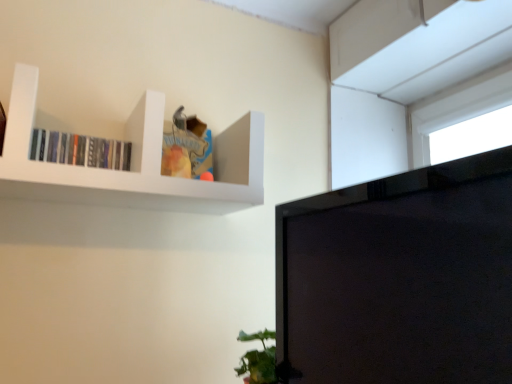
The image size is (512, 384). Describe the element at coordinates (80, 150) in the screenshot. I see `matte black books at upper left` at that location.

Identify the location of white matte shelf at upper left. (132, 163).

The image size is (512, 384). In order to click on matte black books at upper left in this screenshot , I will do `click(80, 150)`.

Does black glossy monitor at upper right have a lesser height compared to white matte shelf at upper left?

Incorrect, the height of black glossy monitor at upper right does not fall short of that of white matte shelf at upper left.

Which is correct: black glossy monitor at upper right is inside white matte shelf at upper left, or outside of it?

black glossy monitor at upper right cannot be found inside white matte shelf at upper left.

Locate an element on the screen. shelf located above the black glossy monitor at upper right (from the image's perspective) is located at coordinates (132, 163).

Where is `shelf that is above the black glossy monitor at upper right (from the image's perspective)`? The image size is (512, 384). shelf that is above the black glossy monitor at upper right (from the image's perspective) is located at coordinates (132, 163).

Between white matte shelf at upper left and black glossy monitor at upper right, which one has smaller width?

black glossy monitor at upper right.

Is white matte shelf at upper left placed right next to black glossy monitor at upper right?

white matte shelf at upper left and black glossy monitor at upper right are not in contact.

From a real-world perspective, is white matte shelf at upper left physically located above or below black glossy monitor at upper right?

white matte shelf at upper left is situated higher than black glossy monitor at upper right in the real world.

Is black glossy monitor at upper right completely or partially outside of matte black books at upper left?

Yes.

Could you tell me if black glossy monitor at upper right is turned towards matte black books at upper left?

No, black glossy monitor at upper right is not oriented towards matte black books at upper left.

Can you confirm if black glossy monitor at upper right is positioned to the left of matte black books at upper left?

No.

Who is more distant, black glossy monitor at upper right or matte black books at upper left?

matte black books at upper left is further away from the camera.

Based on the photo, considering the positions of objects matte black books at upper left and white matte shelf at upper left in the image provided, who is behind, matte black books at upper left or white matte shelf at upper left?

matte black books at upper left is further away from the camera.

Which of these two, matte black books at upper left or white matte shelf at upper left, is smaller?

Smaller between the two is matte black books at upper left.

Is matte black books at upper left situated inside white matte shelf at upper left or outside?

matte black books at upper left is inside white matte shelf at upper left.

Is matte black books at upper left oriented towards black glossy monitor at upper right?

No, matte black books at upper left is not aimed at black glossy monitor at upper right.

Is point (41, 132) closer or farther from the camera than point (311, 323)?

Point (41, 132) is farther from the camera than point (311, 323).

Considering the positions of objects matte black books at upper left and black glossy monitor at upper right in the image provided, who is more to the left, matte black books at upper left or black glossy monitor at upper right?

From the viewer's perspective, matte black books at upper left appears more on the left side.

From a real-world perspective, is white matte shelf at upper left physically below matte black books at upper left?

Yes.

From the image's perspective, which is below, white matte shelf at upper left or matte black books at upper left?

white matte shelf at upper left is shown below in the image.

Find the location of `shelf below the matte black books at upper left (from the image's perspective)`. shelf below the matte black books at upper left (from the image's perspective) is located at coordinates (132, 163).

In the image, there is a black glossy monitor at upper right. Where is `shelf above it (from the image's perspective)`? shelf above it (from the image's perspective) is located at coordinates (132, 163).

Identify the location of computer monitor below the white matte shelf at upper left (from the image's perspective). The image size is (512, 384). (399, 278).

Estimate the real-world distances between objects in this image. Which object is further from black glossy monitor at upper right, matte black books at upper left or white matte shelf at upper left?

Among the two, matte black books at upper left is located further to black glossy monitor at upper right.

Based on their spatial positions, is white matte shelf at upper left or matte black books at upper left further from black glossy monitor at upper right?

matte black books at upper left lies further to black glossy monitor at upper right than the other object.

When comparing their distances from matte black books at upper left, does white matte shelf at upper left or black glossy monitor at upper right seem further?

black glossy monitor at upper right.

Which object lies further to the anchor point white matte shelf at upper left, matte black books at upper left or black glossy monitor at upper right?

black glossy monitor at upper right lies further to white matte shelf at upper left than the other object.

When comparing their distances from white matte shelf at upper left, does black glossy monitor at upper right or matte black books at upper left seem further?

black glossy monitor at upper right.

Which object lies nearer to the anchor point matte black books at upper left, black glossy monitor at upper right or white matte shelf at upper left?

Based on the image, white matte shelf at upper left appears to be nearer to matte black books at upper left.

The width and height of the screenshot is (512, 384). I want to click on shelf between matte black books at upper left and black glossy monitor at upper right, so click(132, 163).